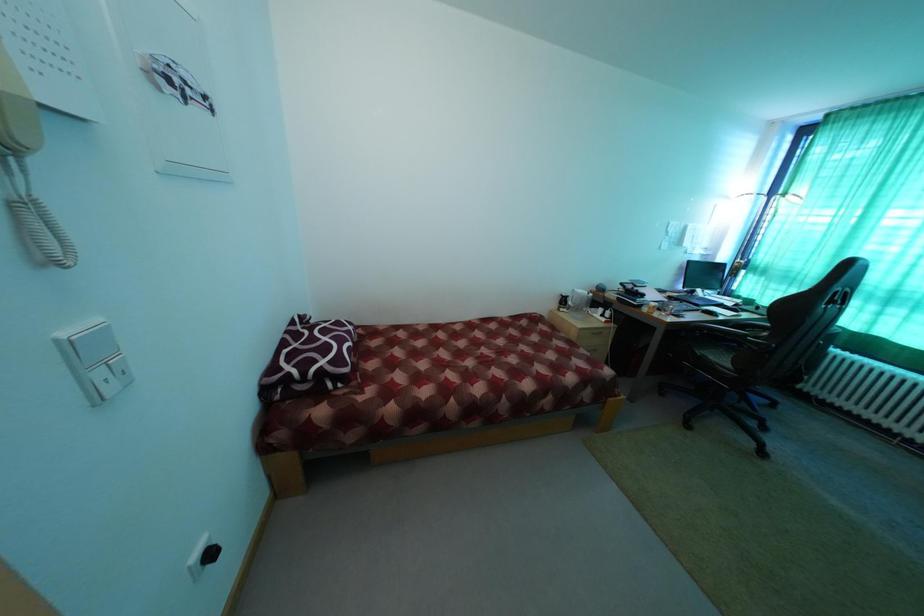
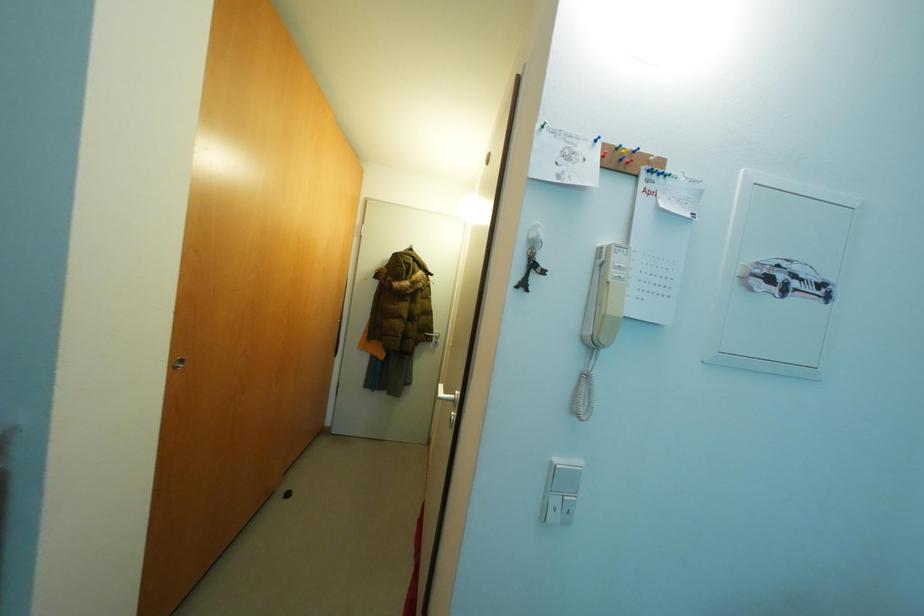
Question: The camera is either moving clockwise (left) or counter-clockwise (right) around the object. The first image is from the beginning of the video and the second image is from the end. Is the camera moving left or right when shooting the video?

Choices:
 (A) Left
 (B) Right

Answer: (B)